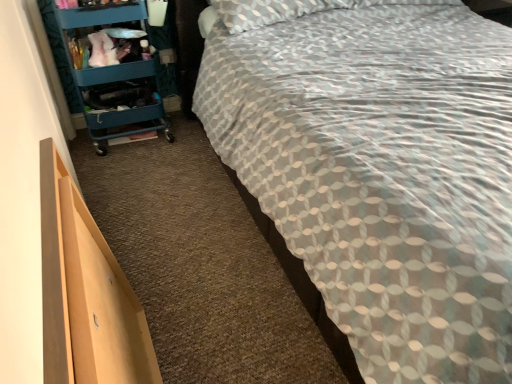
Question: Is light wood drawer at lower left bigger or smaller than patterned fabric bed at center?

Choices:
 (A) small
 (B) big

Answer: (A)

Question: Choose the correct answer: Is light wood drawer at lower left inside patterned fabric bed at center or outside it?

Choices:
 (A) inside
 (B) outside

Answer: (B)

Question: Which object is the farthest from the light wood drawer at lower left?

Choices:
 (A) teal plastic cart at left
 (B) patterned fabric bed at center

Answer: (A)

Question: Which object is positioned farthest from the teal plastic cart at left?

Choices:
 (A) patterned fabric bed at center
 (B) light wood drawer at lower left

Answer: (B)